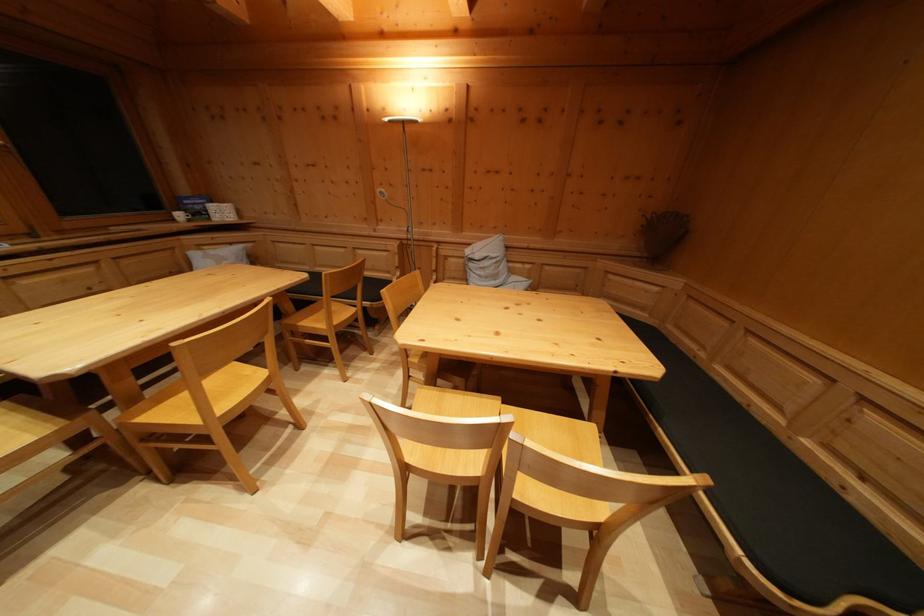
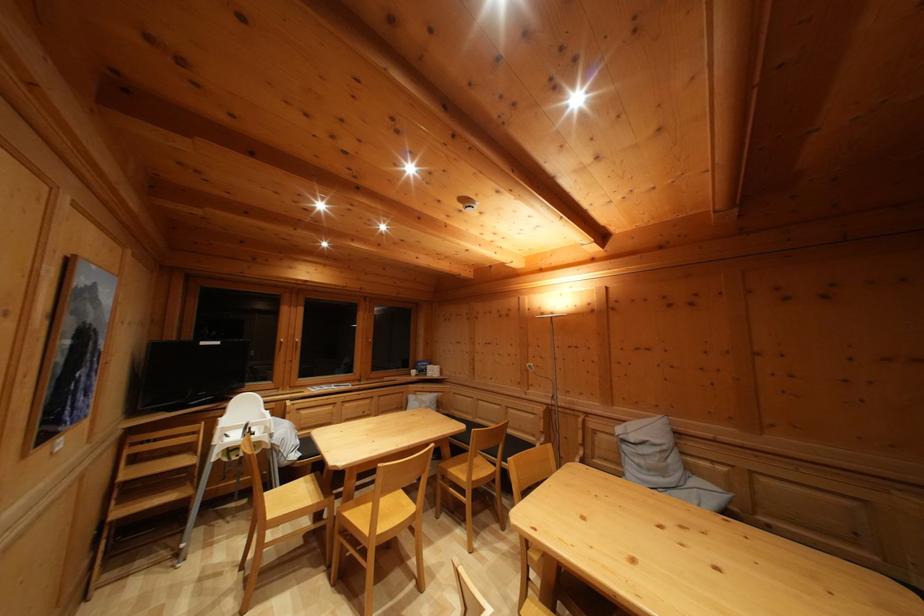
Find the pixel in the second image that matches pixel 186 223 in the first image.

(419, 379)